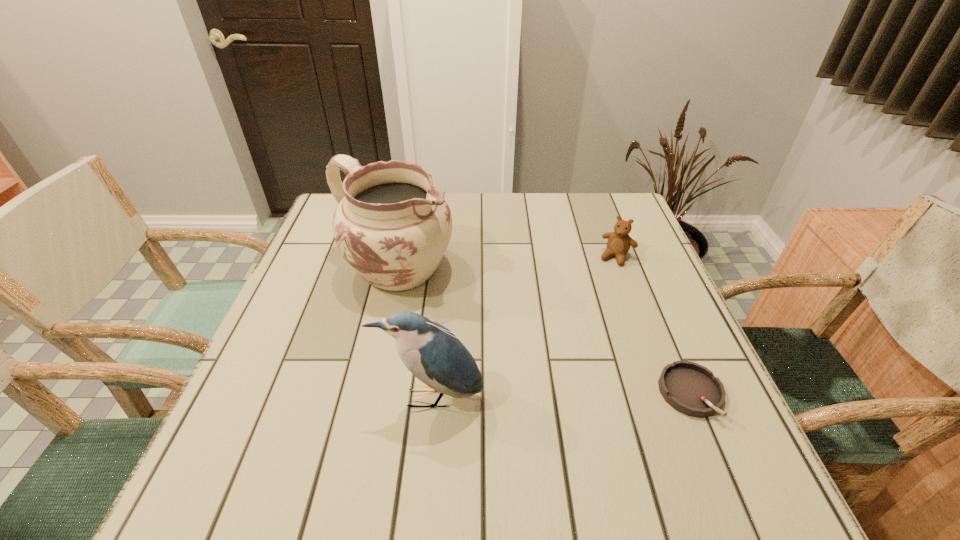
At what (x,y) coordinates should I click in order to perform the action: click on free space on the desktop that is between the bird and the shortest object and is positioned on the spout of the tallest object. Please return your answer as a coordinate pair (x, y). The height and width of the screenshot is (540, 960). Looking at the image, I should click on (592, 395).

This screenshot has height=540, width=960. I want to click on free space on the desktop that is between the bird and the ashtray and is positioned on the front-facing side of the third tallest object, so click(541, 396).